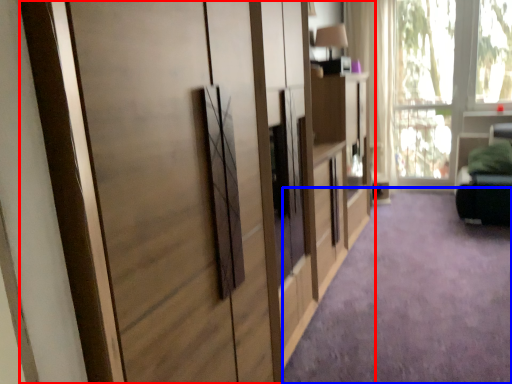
Question: Which point is further to the camera, cupboard (highlighted by a red box) or plain (highlighted by a blue box)?

Choices:
 (A) cupboard
 (B) plain

Answer: (B)